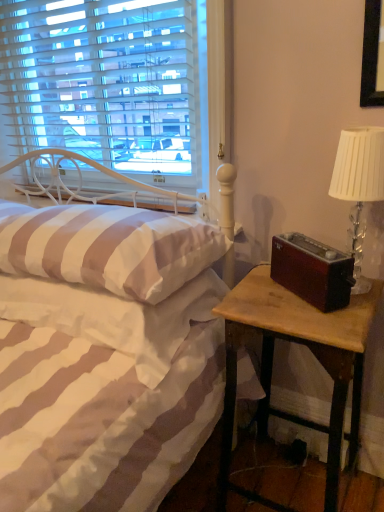
Locate an element on the screen. free point above wooden nightstand at right (from a real-world perspective) is located at coordinates (302, 296).